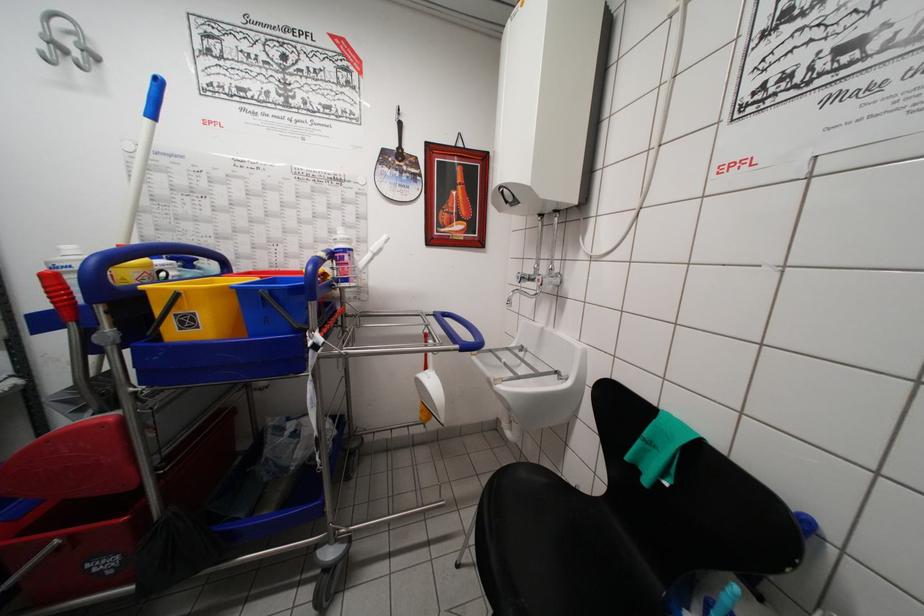
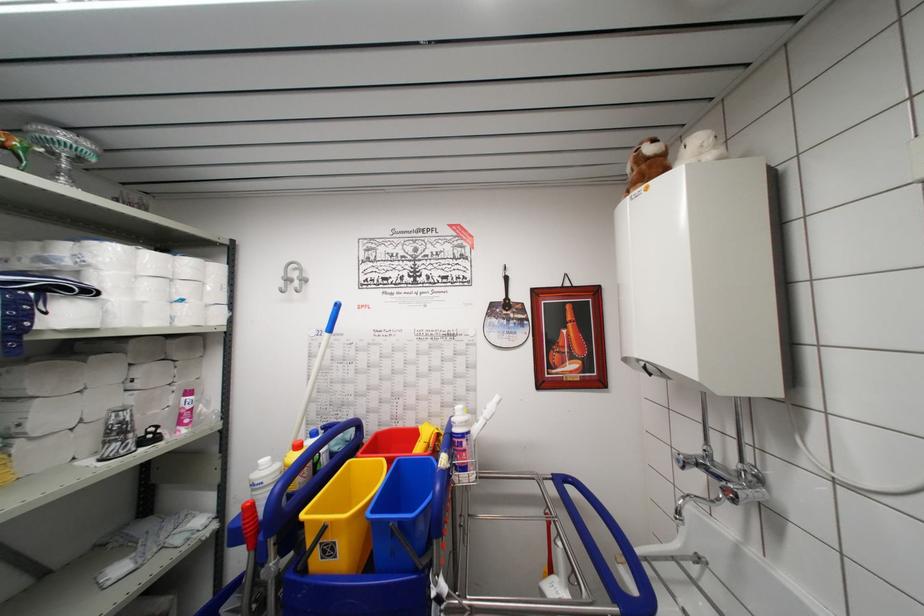
The point at (435,322) is marked in the first image. Where is the corresponding point in the second image?

(554, 487)